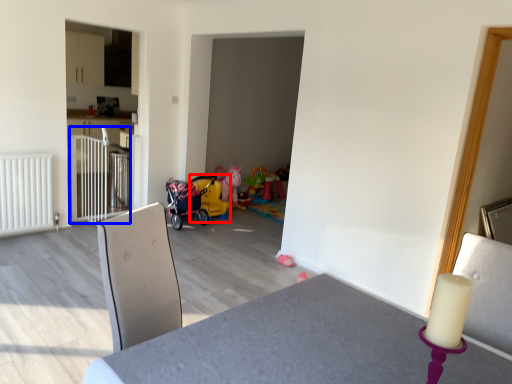
Question: Which of the following is the closest to the observer, baby carriage (highlighted by a red box) or rail (highlighted by a blue box)?

Choices:
 (A) baby carriage
 (B) rail

Answer: (B)